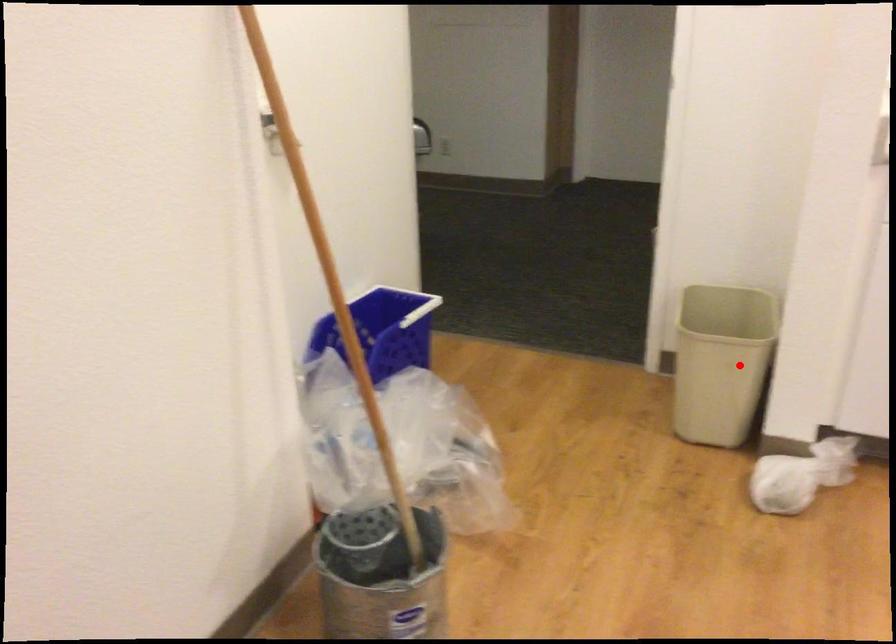
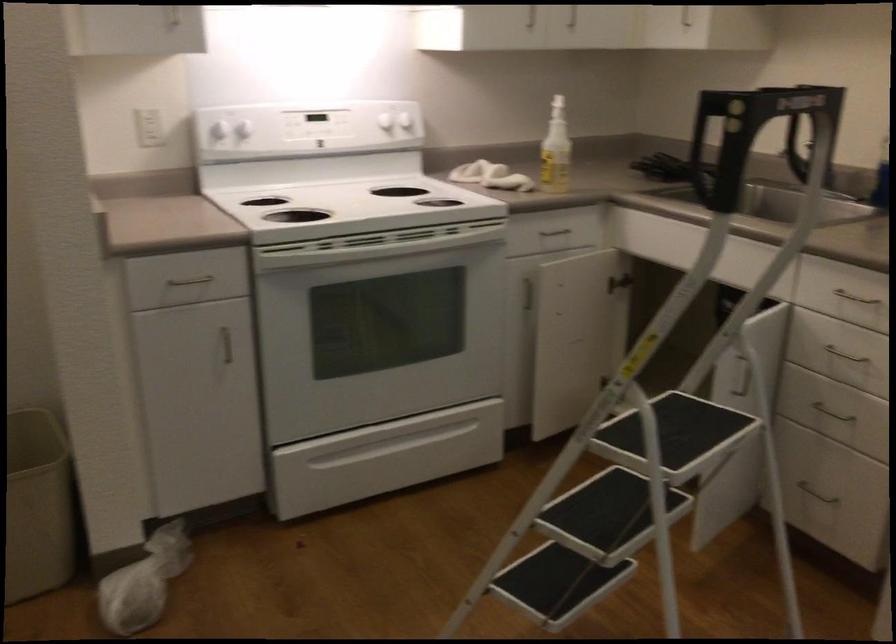
Question: A red point is marked in image1. In image2, is the corresponding 3D point closer to the camera or farther? Reply with the corresponding letter.

Choices:
 (A) The corresponding 3D point is closer.
 (B) The corresponding 3D point is farther.

Answer: (A)